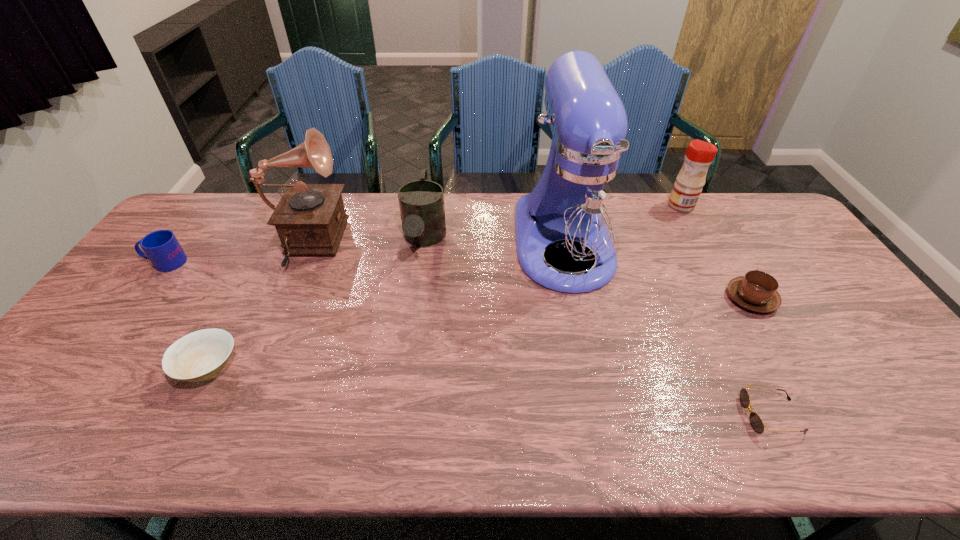
Locate an element on the screen. The height and width of the screenshot is (540, 960). free spot located on the front-facing side of the sunglasses is located at coordinates (678, 415).

You are a GUI agent. You are given a task and a screenshot of the screen. Output one action in this format:
    pyautogui.click(x=<x>, y=<y>)
    Task: Click on the free space located on the front-facing side of the sunglasses
    The image size is (960, 540).
    Given the screenshot: What is the action you would take?
    pyautogui.click(x=607, y=415)

Find the location of a particular element. mixer that is at the far edge is located at coordinates (578, 206).

Where is `record player that is at the far edge`? The width and height of the screenshot is (960, 540). record player that is at the far edge is located at coordinates (310, 219).

You are a GUI agent. You are given a task and a screenshot of the screen. Output one action in this format:
    pyautogui.click(x=<x>, y=<y>)
    Task: Click on the condiment present at the far edge
    Image resolution: width=960 pixels, height=540 pixels.
    Given the screenshot: What is the action you would take?
    pyautogui.click(x=687, y=188)

Locate an element on the screen. This screenshot has width=960, height=540. watering can located in the far edge section of the desktop is located at coordinates (421, 202).

Identify the location of object present at the near edge. (756, 423).

Where is `object positioned at the left edge`? This screenshot has width=960, height=540. object positioned at the left edge is located at coordinates (161, 247).

You are a GUI agent. You are given a task and a screenshot of the screen. Output one action in this format:
    pyautogui.click(x=<x>, y=<y>)
    Task: Click on the free region at the far edge of the desktop
    
    Given the screenshot: What is the action you would take?
    pyautogui.click(x=700, y=228)

Find the location of a particular element. Image resolution: width=960 pixels, height=540 pixels. blank space at the near edge is located at coordinates (180, 418).